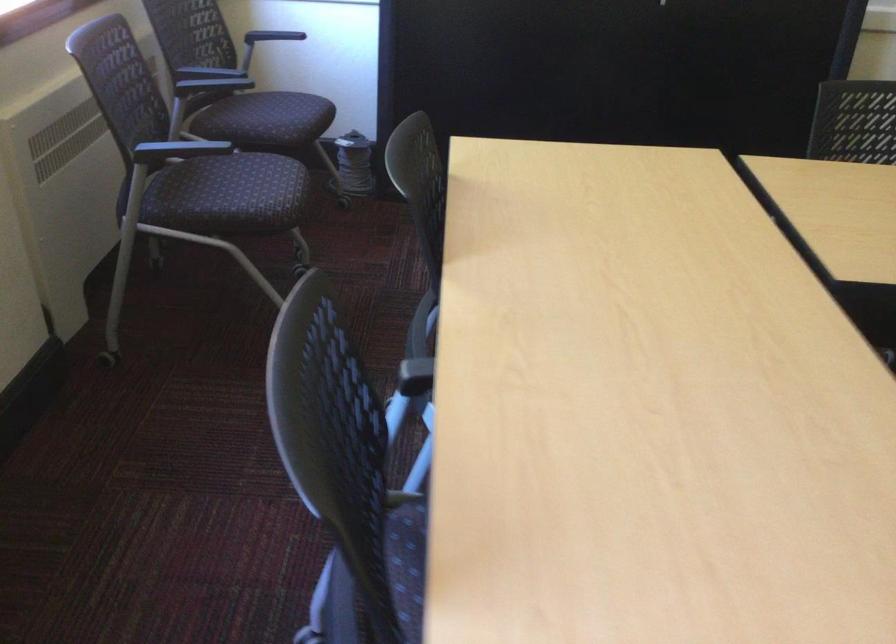
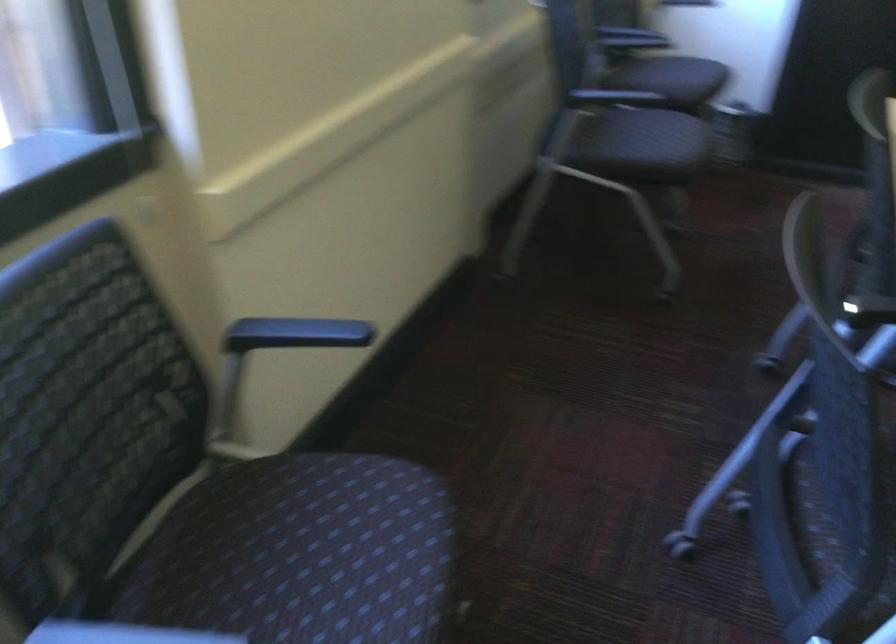
Which direction would the cameraman need to move to produce the second image?

The cameraman moved toward left, backward.